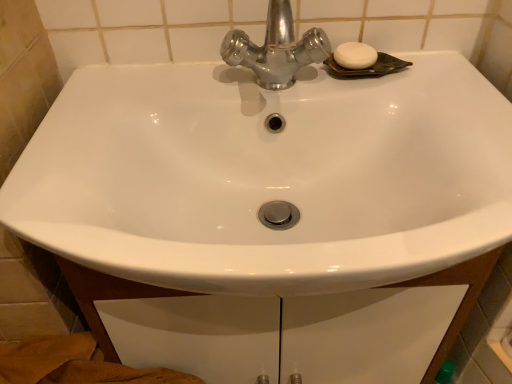
You are a GUI agent. You are given a task and a screenshot of the screen. Output one action in this format:
    pyautogui.click(x=<x>, y=<y>)
    Task: Click on the vacant area situated to the left side of white matte soap at upper right
    The height and width of the screenshot is (384, 512).
    Given the screenshot: What is the action you would take?
    pyautogui.click(x=251, y=76)